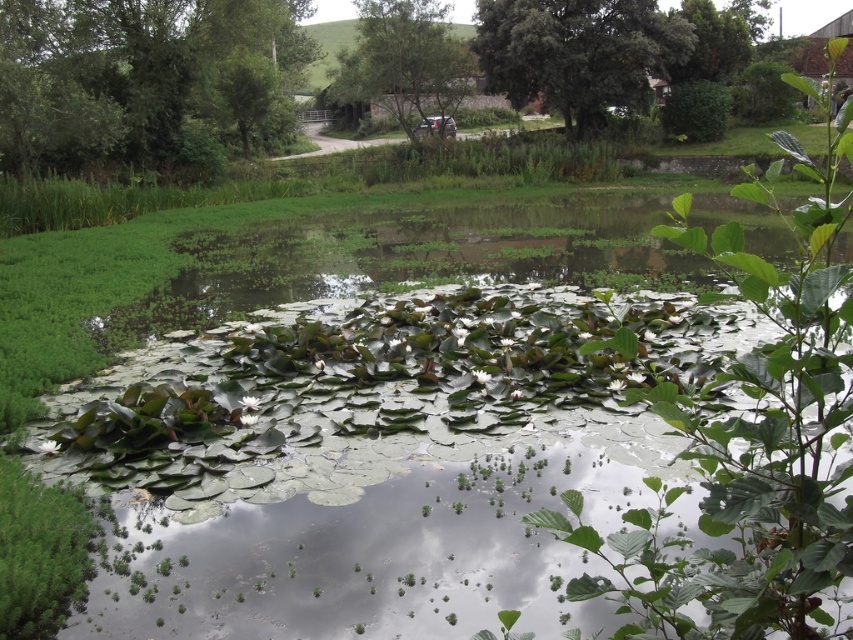
Question: Which point is closer to the camera?

Choices:
 (A) (62, 156)
 (B) (637, 74)
 (C) (393, 26)

Answer: (A)

Question: Which point is farther to the camera?

Choices:
 (A) (38, 67)
 (B) (397, 74)

Answer: (B)

Question: Is green leafy tree at upper left in front of green leafy tree at upper right?

Choices:
 (A) yes
 (B) no

Answer: (A)

Question: Which point is closer to the camera?

Choices:
 (A) (123, 92)
 (B) (633, 67)

Answer: (A)

Question: Is green leafy tree at upper left to the right of green leafy tree at upper right from the viewer's perspective?

Choices:
 (A) yes
 (B) no

Answer: (B)

Question: Is green leafy tree at upper left below green leafy tree at upper right?

Choices:
 (A) no
 (B) yes

Answer: (A)